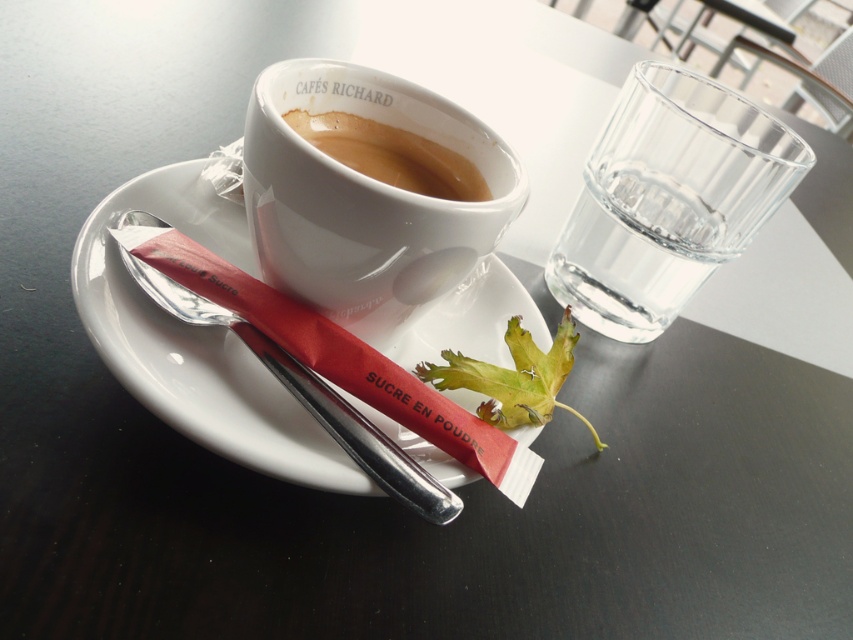
Question: Considering the real-world distances, which object is closest to the white ceramic saucer at center?

Choices:
 (A) brown glossy cup at upper center
 (B) white ceramic mug at upper center

Answer: (B)

Question: Which is nearer to the transparent glass at upper right?

Choices:
 (A) white ceramic saucer at center
 (B) white ceramic mug at upper center
 (C) brown glossy cup at upper center

Answer: (C)

Question: Which of the following is the closest to the observer?

Choices:
 (A) white ceramic mug at upper center
 (B) brown glossy cup at upper center
 (C) transparent glass at upper right

Answer: (A)

Question: Is white ceramic saucer at center above transparent glass at upper right?

Choices:
 (A) no
 (B) yes

Answer: (A)

Question: Can you confirm if white ceramic mug at upper center is positioned below brown glossy cup at upper center?

Choices:
 (A) yes
 (B) no

Answer: (A)

Question: Is white ceramic mug at upper center below transparent glass at upper right?

Choices:
 (A) yes
 (B) no

Answer: (A)